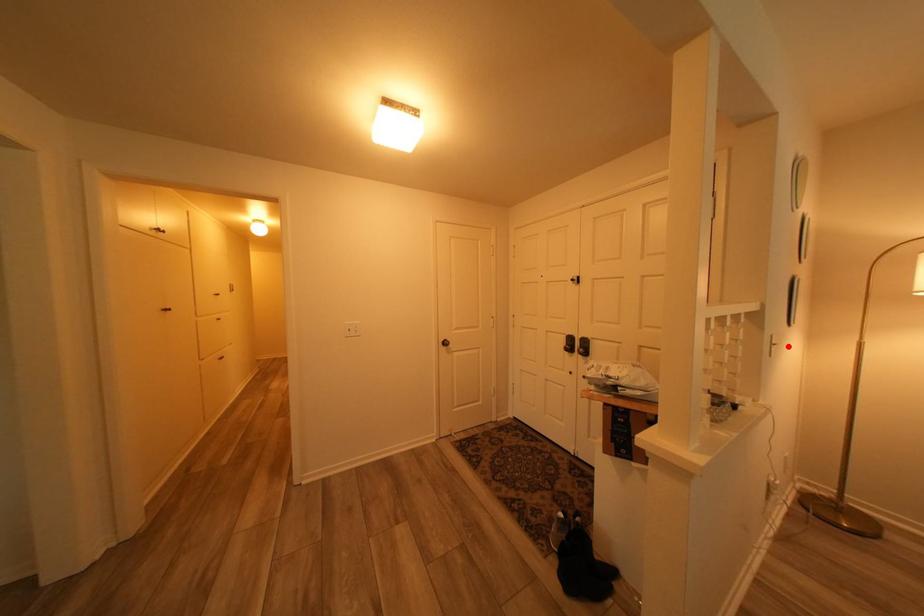
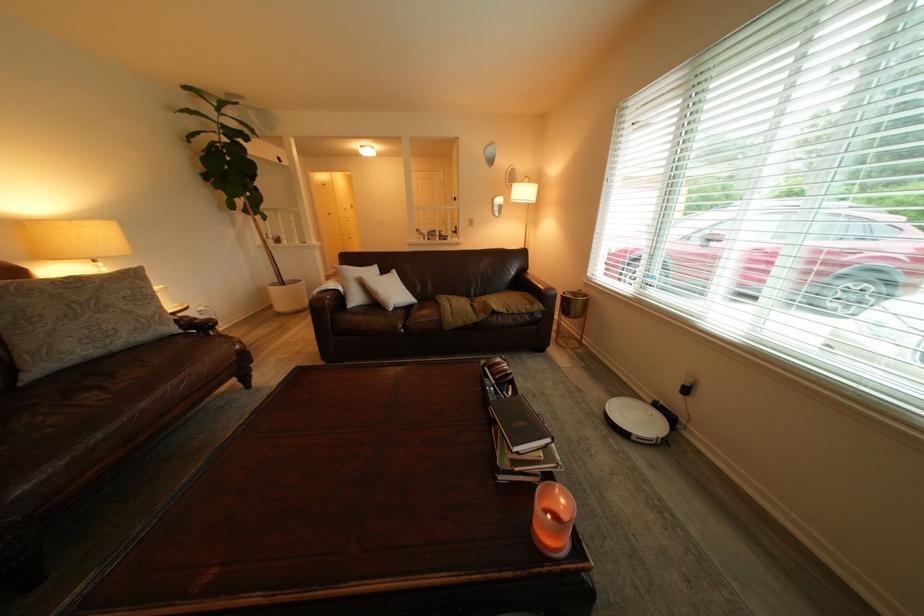
Question: I am providing you with two images of the same scene from different viewpoints. In image1, a red point is highlighted. Considering the same 3D point in image2, which of the following is correct?

Choices:
 (A) It is closer
 (B) It is farther

Answer: (A)